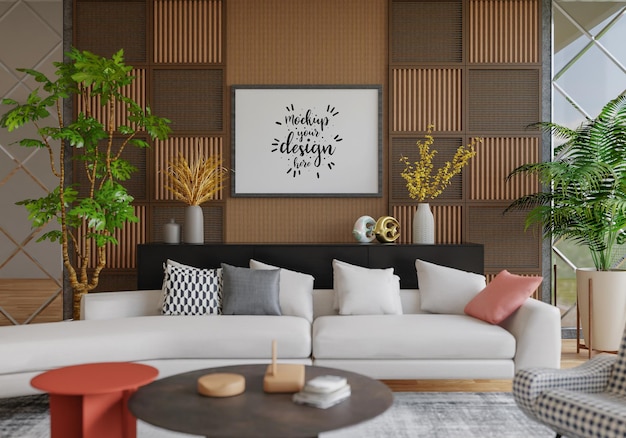
Where is `orangish red side table`? orangish red side table is located at coordinates (111, 384).